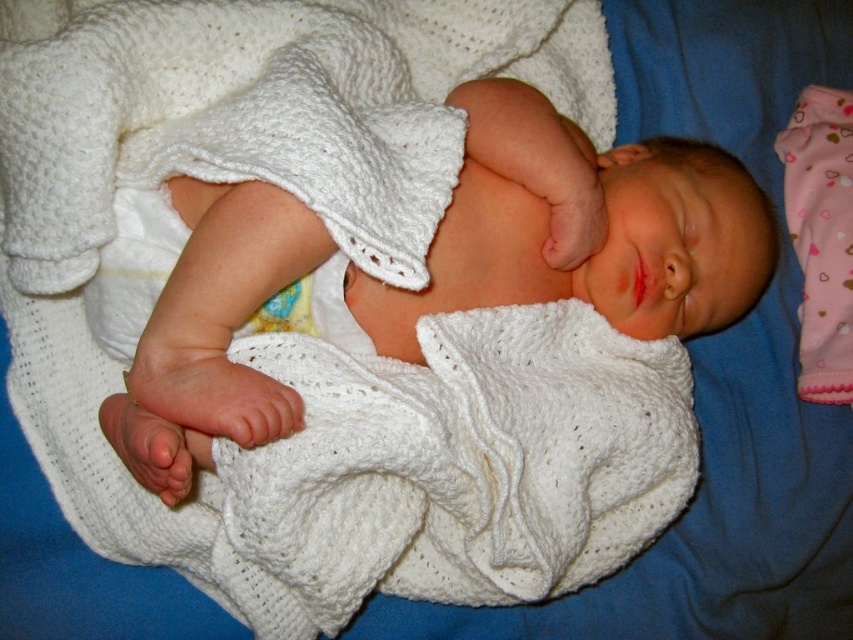
Question: Among these objects, which one is farthest from the camera?

Choices:
 (A) white knitted blanket at center
 (B) smooth plastic teething ring at center

Answer: (B)

Question: Is white knitted blanket at center below smooth plastic teething ring at center?

Choices:
 (A) no
 (B) yes

Answer: (A)

Question: Does white knitted blanket at center appear under smooth plastic teething ring at center?

Choices:
 (A) no
 (B) yes

Answer: (A)

Question: Can you confirm if white knitted blanket at center is positioned above smooth plastic teething ring at center?

Choices:
 (A) yes
 (B) no

Answer: (A)